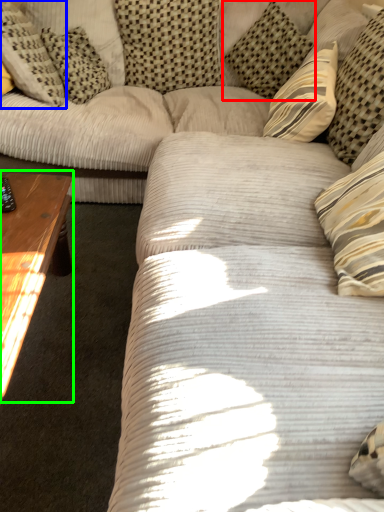
Question: Based on their relative distances, which object is farther from pillow (highlighted by a red box)? Choose from pillow (highlighted by a blue box) and coffee table (highlighted by a green box).

Choices:
 (A) pillow
 (B) coffee table

Answer: (B)